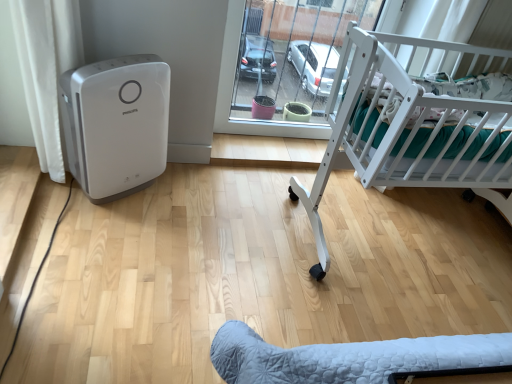
Question: Can you confirm if white matte crib at right is thinner than transparent glass door at center?

Choices:
 (A) no
 (B) yes

Answer: (A)

Question: Can you see white matte crib at right touching transparent glass door at center?

Choices:
 (A) no
 (B) yes

Answer: (A)

Question: Is white matte crib at right turned away from transparent glass door at center?

Choices:
 (A) no
 (B) yes

Answer: (B)

Question: Would you say white matte crib at right contains transparent glass door at center?

Choices:
 (A) no
 (B) yes

Answer: (A)

Question: From the image's perspective, is white matte crib at right above transparent glass door at center?

Choices:
 (A) no
 (B) yes

Answer: (A)

Question: Would you say white matte crib at right is a long distance from transparent glass door at center?

Choices:
 (A) yes
 (B) no

Answer: (B)

Question: Is white plastic air purifier at left to the left of transparent glass door at center from the viewer's perspective?

Choices:
 (A) yes
 (B) no

Answer: (A)

Question: Is white plastic air purifier at left oriented away from transparent glass door at center?

Choices:
 (A) no
 (B) yes

Answer: (A)

Question: Considering the relative sizes of white plastic air purifier at left and transparent glass door at center in the image provided, is white plastic air purifier at left bigger than transparent glass door at center?

Choices:
 (A) yes
 (B) no

Answer: (B)

Question: Does white plastic air purifier at left contain transparent glass door at center?

Choices:
 (A) no
 (B) yes

Answer: (A)

Question: Is white plastic air purifier at left completely or partially outside of transparent glass door at center?

Choices:
 (A) no
 (B) yes

Answer: (B)

Question: Considering the relative sizes of white plastic air purifier at left and transparent glass door at center in the image provided, is white plastic air purifier at left thinner than transparent glass door at center?

Choices:
 (A) yes
 (B) no

Answer: (B)

Question: Are transparent glass door at center and white matte crib at right far apart?

Choices:
 (A) yes
 (B) no

Answer: (B)